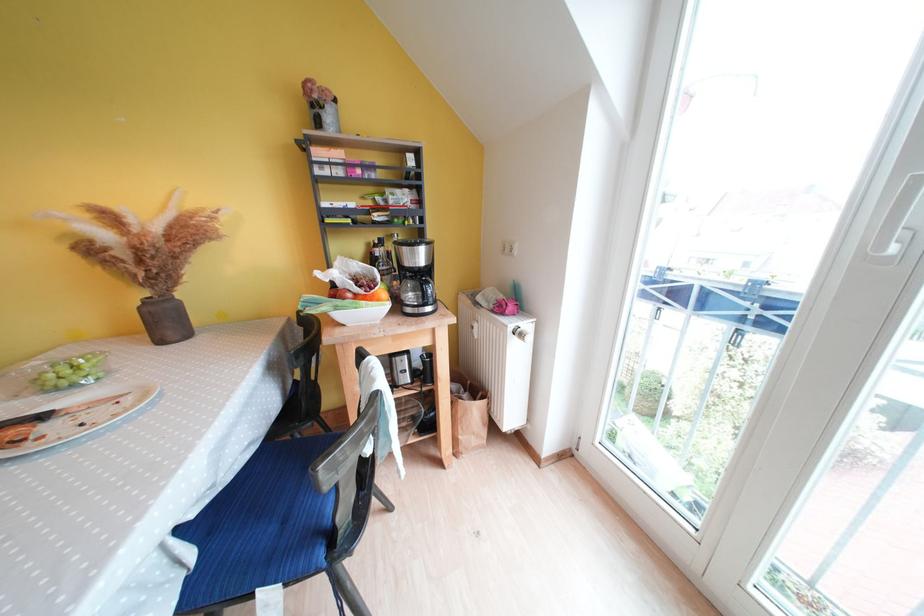
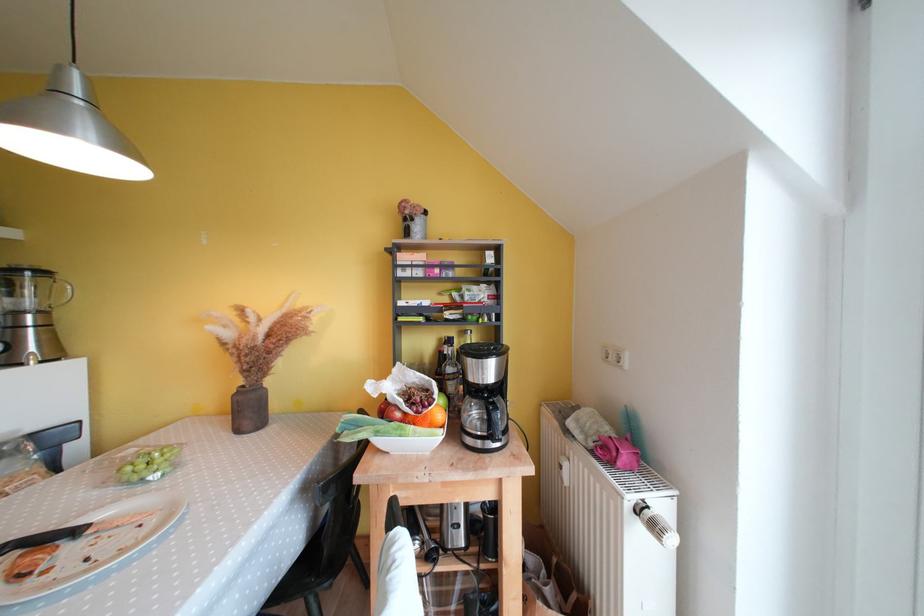
In the second image, find the point that corresponds to (516,333) in the first image.

(634, 509)